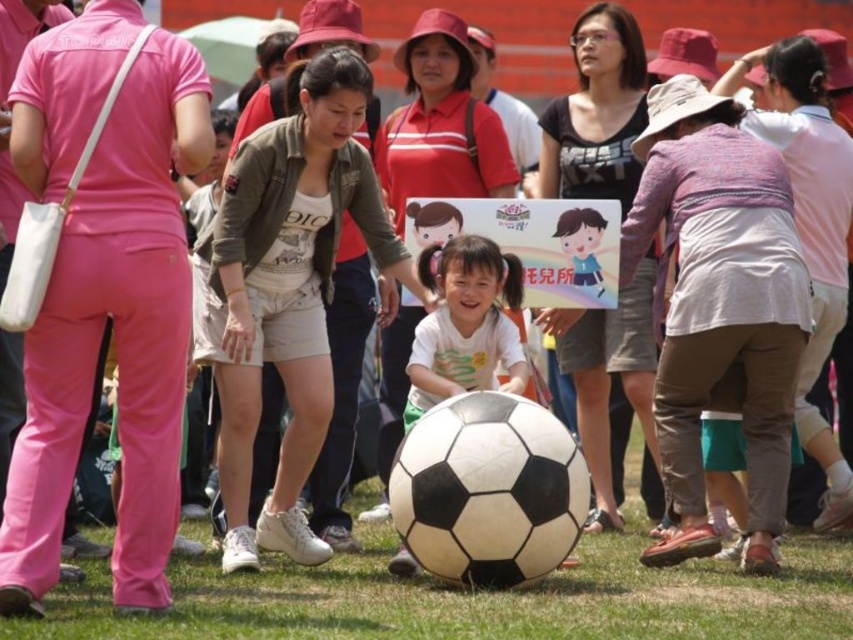
Question: Which object appears closest to the camera in this image?

Choices:
 (A) matte green jacket at center
 (B) matte black shirt at center
 (C) matte white shirt at center

Answer: (A)

Question: Is matte green jacket at center below white matte soccer ball at center?

Choices:
 (A) yes
 (B) no

Answer: (B)

Question: Estimate the real-world distances between objects in this image. Which object is closer to the green grass at center?

Choices:
 (A) matte green jacket at center
 (B) matte black shirt at center
 (C) white matte soccer ball at center
 (D) matte white shirt at center

Answer: (A)

Question: Which point is farther from the camera taking this photo?

Choices:
 (A) (428, 342)
 (B) (625, 600)
 (C) (614, 499)
 (D) (328, 65)

Answer: (C)

Question: Does green grass at center appear over matte green jacket at center?

Choices:
 (A) yes
 (B) no

Answer: (B)

Question: Does matte green jacket at center have a larger size compared to white matte soccer ball at center?

Choices:
 (A) no
 (B) yes

Answer: (B)